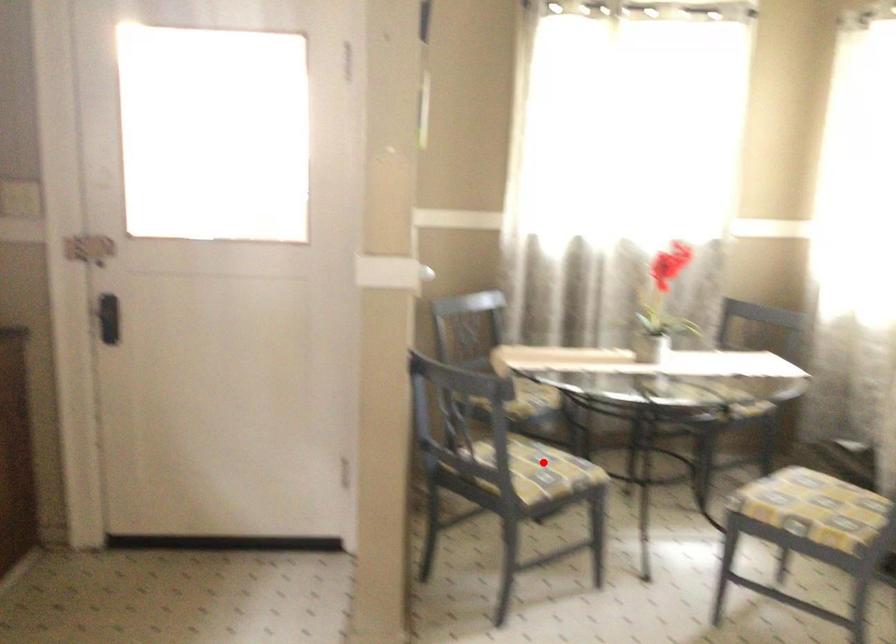
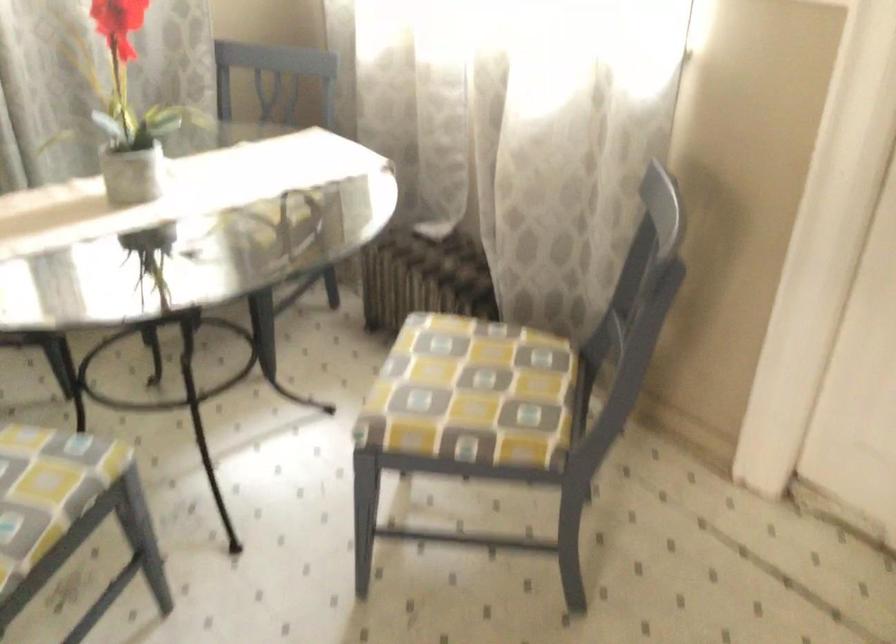
In the second image, find the point that corresponds to the highlighted location in the first image.

(46, 483)